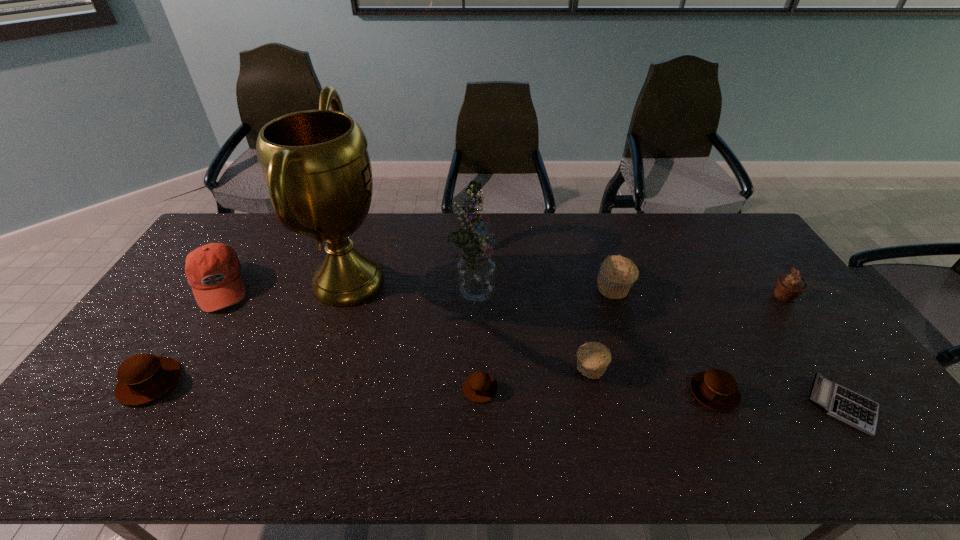
What are the coordinates of `free space located 0.310m on the right of the farther beige muffin` in the screenshot? It's located at (730, 288).

Find the location of a particular element. This screenshot has width=960, height=540. free space located 0.140m on the back of the rightmost muffin is located at coordinates (757, 260).

At what (x,y) coordinates should I click in order to perform the action: click on blank area located on the right of the nearer beige muffin. Please return your answer as a coordinate pair (x, y). Looking at the image, I should click on (640, 369).

Find the location of a particular element. This screenshot has height=540, width=960. vacant space located on the left of the leftmost muffin is located at coordinates (99, 382).

Identify the location of vacant space located 0.250m on the right of the rightmost brown muffin. Image resolution: width=960 pixels, height=540 pixels. (835, 393).

Identify the location of vacant position located 0.050m on the front of the second shortest object. (480, 422).

This screenshot has width=960, height=540. I want to click on free space located 0.100m on the left of the calculator, so click(x=767, y=404).

Identify the location of object located in the far edge section of the desktop. The height and width of the screenshot is (540, 960). (316, 165).

I want to click on object located at the near edge, so click(850, 407).

Locate an element on the screen. baseball cap that is at the left edge is located at coordinates (213, 270).